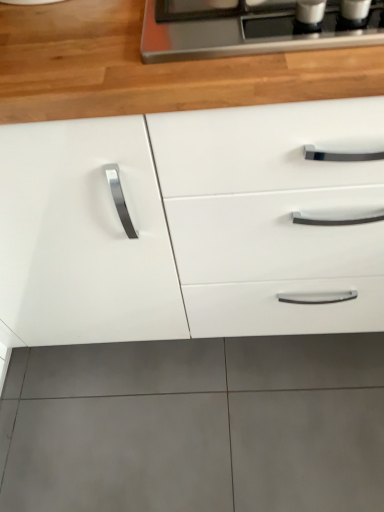
Locate an element on the screen. This screenshot has height=512, width=384. white glossy cabinet at center is located at coordinates (194, 224).

Describe the element at coordinates (194, 224) in the screenshot. Image resolution: width=384 pixels, height=512 pixels. I see `white glossy cabinet at center` at that location.

Where is `wooden at upper center`? The width and height of the screenshot is (384, 512). wooden at upper center is located at coordinates (151, 68).

What do you see at coordinates (151, 68) in the screenshot?
I see `wooden at upper center` at bounding box center [151, 68].

Where is `white glossy cabinet at center`? The height and width of the screenshot is (512, 384). white glossy cabinet at center is located at coordinates (194, 224).

Between white glossy cabinet at center and wooden at upper center, which one appears on the right side from the viewer's perspective?

Positioned to the right is wooden at upper center.

Based on the photo, considering the positions of objects white glossy cabinet at center and wooden at upper center in the image provided, who is behind, white glossy cabinet at center or wooden at upper center?

wooden at upper center is further away from the camera.

Which point is more distant from viewer, (347,182) or (13,36)?

The point (347,182) is farther from the camera.

Looking at this image, from the image's perspective, which one is positioned higher, white glossy cabinet at center or wooden at upper center?

wooden at upper center is shown above in the image.

From a real-world perspective, who is located higher, white glossy cabinet at center or wooden at upper center?

In real-world perspective, wooden at upper center is above.

Between white glossy cabinet at center and wooden at upper center, which one has larger width?

white glossy cabinet at center.

Consider the image. Is white glossy cabinet at center taller or shorter than wooden at upper center?

white glossy cabinet at center is taller than wooden at upper center.

Does white glossy cabinet at center have a smaller size compared to wooden at upper center?

No, white glossy cabinet at center is not smaller than wooden at upper center.

Which is correct: white glossy cabinet at center is inside wooden at upper center, or outside of it?

white glossy cabinet at center is located beyond the bounds of wooden at upper center.

Is white glossy cabinet at center next to wooden at upper center and touching it?

No, white glossy cabinet at center is not with wooden at upper center.

Could you tell me if white glossy cabinet at center is turned towards wooden at upper center?

Yes, white glossy cabinet at center is turned towards wooden at upper center.

Can you tell me how much white glossy cabinet at center and wooden at upper center differ in facing direction?

The angle between the facing direction of white glossy cabinet at center and the facing direction of wooden at upper center is 1.35 degrees.

This screenshot has width=384, height=512. What are the coordinates of `countertop located above the white glossy cabinet at center (from a real-world perspective)` in the screenshot? It's located at (151, 68).

In the scene shown: Is wooden at upper center to the right of white glossy cabinet at center from the viewer's perspective?

Indeed, wooden at upper center is positioned on the right side of white glossy cabinet at center.

Is wooden at upper center closer to the viewer compared to white glossy cabinet at center?

That is False.

Is point (19, 57) farther from camera compared to point (37, 332)?

No, (19, 57) is in front of (37, 332).

From the image's perspective, which one is positioned lower, wooden at upper center or white glossy cabinet at center?

From the image's view, white glossy cabinet at center is below.

From a real-world perspective, is wooden at upper center over white glossy cabinet at center?

Yes, from a real-world perspective, wooden at upper center is on top of white glossy cabinet at center.

Can you confirm if wooden at upper center is thinner than white glossy cabinet at center?

Indeed, wooden at upper center has a lesser width compared to white glossy cabinet at center.

Can you confirm if wooden at upper center is shorter than white glossy cabinet at center?

Yes, wooden at upper center is shorter than white glossy cabinet at center.

Between wooden at upper center and white glossy cabinet at center, which one has smaller size?

wooden at upper center is smaller.

From the picture: Is wooden at upper center outside of white glossy cabinet at center?

No, wooden at upper center is not entirely external to white glossy cabinet at center.

From the picture: Is wooden at upper center in contact with white glossy cabinet at center?

No, wooden at upper center is not touching white glossy cabinet at center.

Does wooden at upper center turn towards white glossy cabinet at center?

Yes, wooden at upper center faces towards white glossy cabinet at center.

How different are the orientations of wooden at upper center and white glossy cabinet at center in degrees?

They differ by 1.35 degrees in their facing directions.

Find the location of a particular element. The image size is (384, 512). cabinetry below the wooden at upper center (from a real-world perspective) is located at coordinates point(194,224).

Locate an element on the screen. cabinetry in front of the wooden at upper center is located at coordinates coord(194,224).

At what (x,y) coordinates should I click in order to perform the action: click on cabinetry that appears below the wooden at upper center (from a real-world perspective). Please return your answer as a coordinate pair (x, y). The height and width of the screenshot is (512, 384). Looking at the image, I should click on (194, 224).